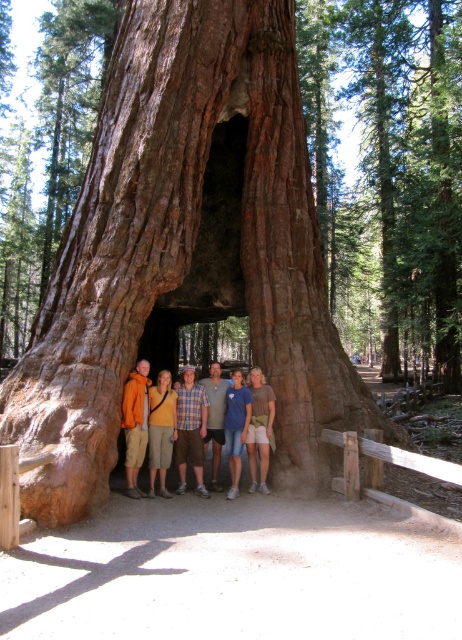
Question: Based on their relative distances, which object is nearer to the orange cotton hoodie at center?

Choices:
 (A) blue cotton shirt at center
 (B) matte orange jacket at center

Answer: (B)

Question: Considering the real-world distances, which object is farthest from the plaid shirt at center?

Choices:
 (A) blue cotton shirt at center
 (B) orange cotton hoodie at center
 (C) matte orange jacket at center

Answer: (A)

Question: Estimate the real-world distances between objects in this image. Which object is closer to the matte orange jacket at center?

Choices:
 (A) light brown textured shorts at center
 (B) brown rough tree trunk at center
 (C) matte orange shirt at center
 (D) blue cotton shirt at center

Answer: (C)

Question: Can you confirm if plaid shirt at center is smaller than light brown textured shorts at center?

Choices:
 (A) no
 (B) yes

Answer: (A)

Question: Can you confirm if light brown textured shorts at center is positioned to the left of gray cotton shirt at center?

Choices:
 (A) yes
 (B) no

Answer: (B)

Question: Can you confirm if brown rough tree trunk at center is smaller than matte orange jacket at center?

Choices:
 (A) yes
 (B) no

Answer: (A)